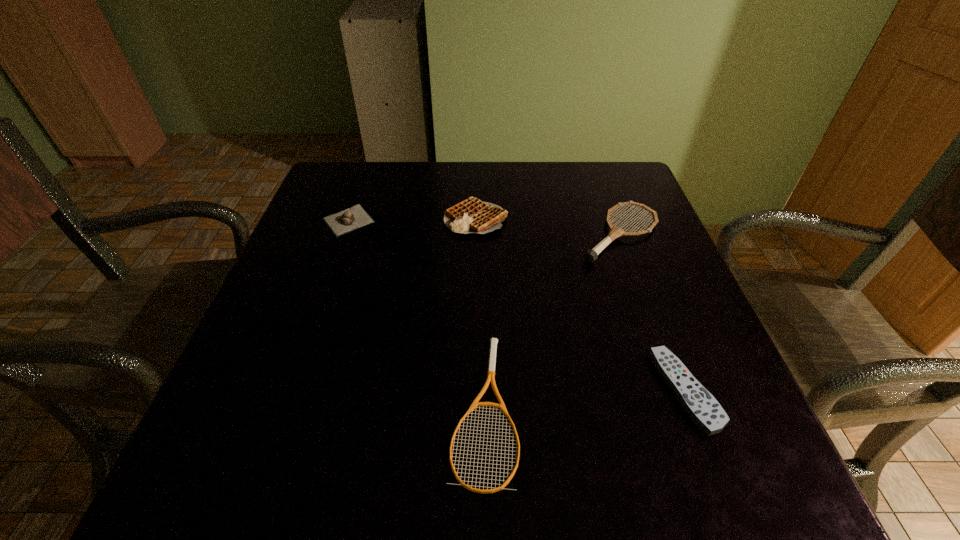
Where is `remote control present at the right edge`? This screenshot has width=960, height=540. remote control present at the right edge is located at coordinates (700, 405).

I want to click on object that is at the far left corner, so click(353, 218).

Image resolution: width=960 pixels, height=540 pixels. I want to click on object that is at the far right corner, so click(590, 256).

What are the coordinates of `object at the near right corner` in the screenshot? It's located at (700, 405).

Where is `vacant space at the far edge of the desktop`? vacant space at the far edge of the desktop is located at coordinates click(x=503, y=168).

Where is `vacant space at the left edge of the desktop`? vacant space at the left edge of the desktop is located at coordinates (321, 347).

The height and width of the screenshot is (540, 960). In the image, there is a desktop. Identify the location of free space at the right edge. (650, 242).

Find the location of a particular element. The height and width of the screenshot is (540, 960). vacant space at the far left corner of the desktop is located at coordinates (384, 175).

You are a GUI agent. You are given a task and a screenshot of the screen. Output one action in this format:
    pyautogui.click(x=<x>, y=<y>)
    Task: Click on the empty space between the nearer tennis racket and the third shortest object
    
    Given the screenshot: What is the action you would take?
    pyautogui.click(x=417, y=314)

Locate an element on the screen. The height and width of the screenshot is (540, 960). vacant space that's between the garlic and the remote control is located at coordinates (517, 306).